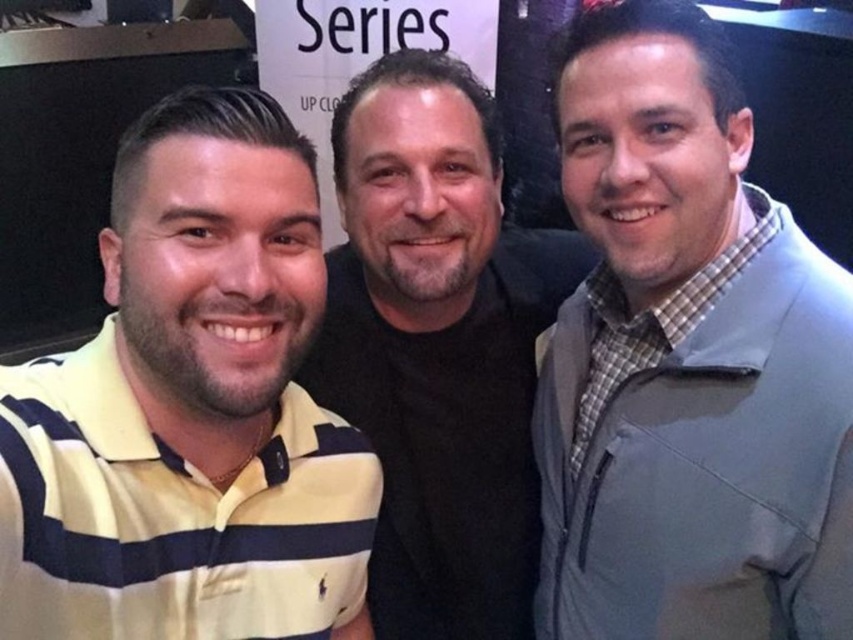
Does yellow striped polo shirt at right have a greater height compared to black matte shirt at center?

Incorrect, yellow striped polo shirt at right's height is not larger of black matte shirt at center's.

Which is above, yellow striped polo shirt at right or black matte shirt at center?

Positioned higher is black matte shirt at center.

Describe the element at coordinates (700, 451) in the screenshot. The image size is (853, 640). I see `yellow striped polo shirt at right` at that location.

You are a GUI agent. You are given a task and a screenshot of the screen. Output one action in this format:
    pyautogui.click(x=<x>, y=<y>)
    Task: Click on the yellow striped polo shirt at right
    Image resolution: width=853 pixels, height=640 pixels.
    Given the screenshot: What is the action you would take?
    pyautogui.click(x=700, y=451)

Does yellow striped polo shirt at left come behind black matte shirt at center?

No, yellow striped polo shirt at left is closer to the viewer.

Is yellow striped polo shirt at left thinner than black matte shirt at center?

Yes, yellow striped polo shirt at left is thinner than black matte shirt at center.

The image size is (853, 640). What are the coordinates of `yellow striped polo shirt at left` in the screenshot? It's located at tap(190, 408).

Does yellow striped polo shirt at left have a lesser height compared to yellow striped polo shirt at right?

Incorrect, yellow striped polo shirt at left's height does not fall short of yellow striped polo shirt at right's.

Can you confirm if yellow striped polo shirt at left is taller than yellow striped polo shirt at right?

Correct, yellow striped polo shirt at left is much taller as yellow striped polo shirt at right.

Locate an element on the screen. This screenshot has width=853, height=640. yellow striped polo shirt at left is located at coordinates (190, 408).